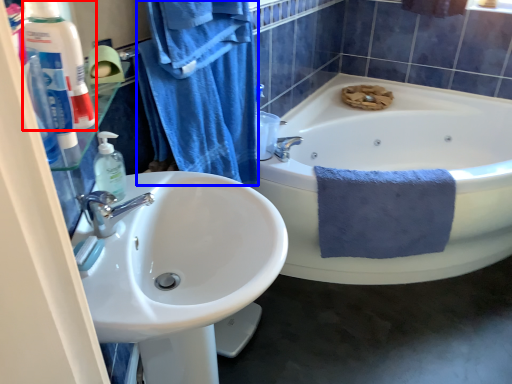
Question: Which object appears closest to the camera in this image, toiletry (highlighted by a red box) or bath towel (highlighted by a blue box)?

Choices:
 (A) toiletry
 (B) bath towel

Answer: (A)